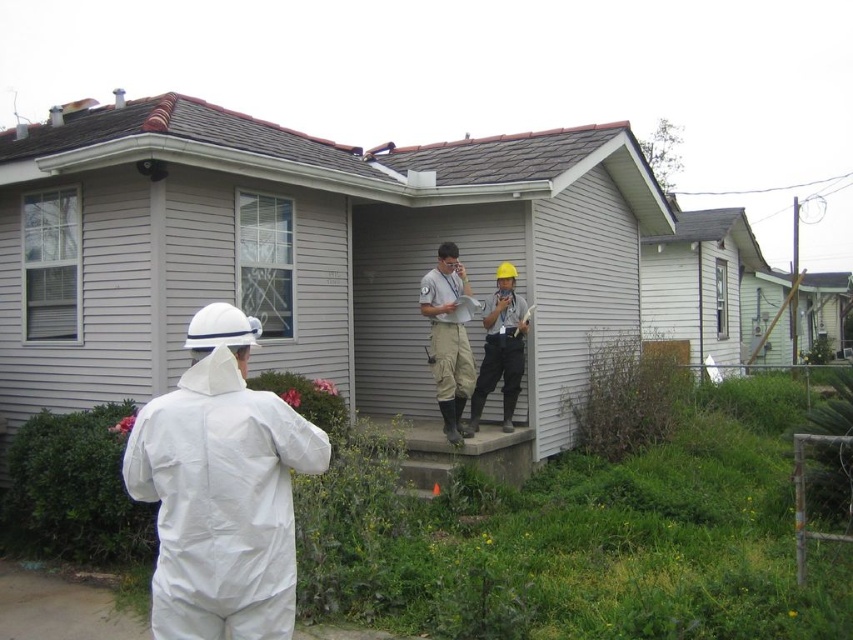
Is matte gray uniform at center positioned at the back of hard hat at center?

No, it is not.

Is point (445, 429) positioned before point (520, 304)?

Yes, it is.

Who is more forward, (428, 316) or (506, 333)?

Point (428, 316) is more forward.

Locate an element on the screen. matte gray uniform at center is located at coordinates (448, 337).

Does point (274, 481) come farther from viewer compared to point (442, 294)?

No, it is in front of (442, 294).

Can you confirm if white matte suit at left is shorter than matte gray uniform at center?

Indeed, white matte suit at left has a lesser height compared to matte gray uniform at center.

Between point (265, 564) and point (460, 442), which one is positioned in front?

Point (265, 564) is in front.

You are a GUI agent. You are given a task and a screenshot of the screen. Output one action in this format:
    pyautogui.click(x=<x>, y=<y>)
    Task: Click on the white matte suit at left
    
    Given the screenshot: What is the action you would take?
    pyautogui.click(x=221, y=490)

Can you confirm if white matte suit at left is positioned below hard hat at center?

Correct, white matte suit at left is located below hard hat at center.

Who is taller, white matte suit at left or hard hat at center?

hard hat at center

Between point (173, 604) and point (469, 428), which one is positioned in front?

Point (173, 604) is more forward.

In order to click on white matte suit at left in this screenshot , I will do `click(221, 490)`.